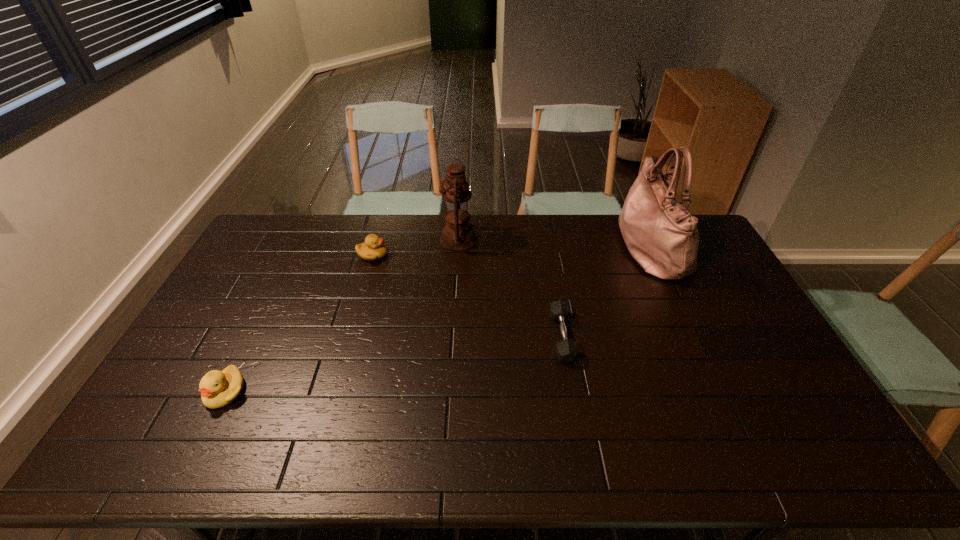
This screenshot has height=540, width=960. What are the coordinates of `vacant position in the image that satisfies the following two spatial constraints: 1. at the beak of the right duckling; 2. on the back side of the dumbbell` in the screenshot? It's located at (349, 336).

Where is `free space that satisfies the following two spatial constraints: 1. on the back side of the dumbbell; 2. at the beak of the farther duckling`? free space that satisfies the following two spatial constraints: 1. on the back side of the dumbbell; 2. at the beak of the farther duckling is located at coordinates (547, 255).

At what (x,y) coordinates should I click in order to perform the action: click on free space that satisfies the following two spatial constraints: 1. at the beak of the second nearest object; 2. on the left side of the fourth object from right to left. Please return your answer as a coordinate pair (x, y). The image size is (960, 540). Looking at the image, I should click on (349, 336).

You are a GUI agent. You are given a task and a screenshot of the screen. Output one action in this format:
    pyautogui.click(x=<x>, y=<y>)
    Task: Click on the vacant position in the image that satisfies the following two spatial constraints: 1. at the front of the handbag with handles; 2. at the face of the nearer duckling
    The image size is (960, 540).
    Given the screenshot: What is the action you would take?
    pyautogui.click(x=717, y=392)

Where is `vacant area that satisfies the following two spatial constraints: 1. at the beak of the second object from left to right; 2. on the right side of the fourth farthest object`? The image size is (960, 540). vacant area that satisfies the following two spatial constraints: 1. at the beak of the second object from left to right; 2. on the right side of the fourth farthest object is located at coordinates (349, 336).